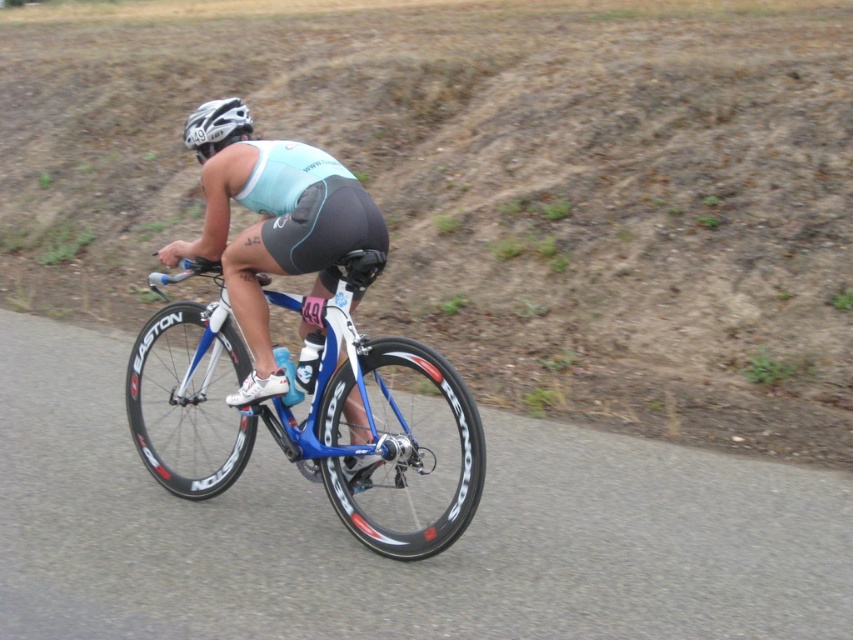
You are a photographer positioned at the starting line of a cycling race. You want to capture a photo of the cyclist and their equipment. Based on the scene, can you determine which object is closer to you between the blue metallic bicycle at center and the white matte helmet at upper center?

The blue metallic bicycle at center is in front of the white matte helmet at upper center, so the bicycle is closer to you.

You are a photographer positioned at the origin of the coordinate system. You want to capture a photo of the blue metallic bicycle at center located at point (312, 413). What is the exact coordinate of the bicycle?

The blue metallic bicycle at center is located exactly at point (312, 413).

You are a photographer positioned at the side of the road. You want to capture a closeup shot of the cyclist while ensuring both the blue metallic bicycle at center and the white matte helmet at upper center are visible. Which object should you zoom in on to ensure both are in frame without cropping either?

You should zoom in on the white matte helmet at upper center because the blue metallic bicycle at center is wider than the white matte helmet at upper center. By focusing on the smaller object, you can include both in the frame without cropping.